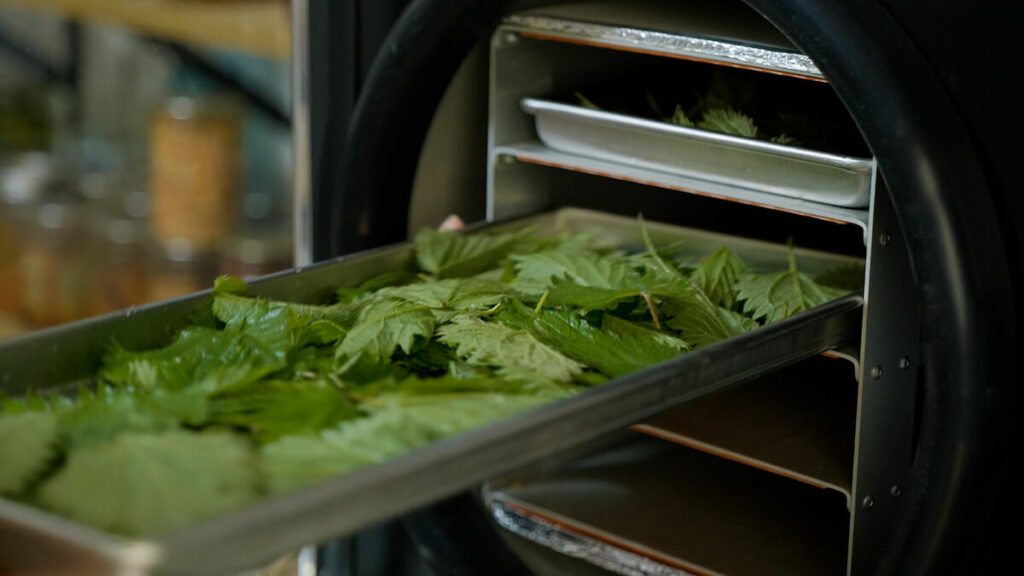
This screenshot has width=1024, height=576. I want to click on trays, so click(x=811, y=178), click(x=56, y=537).